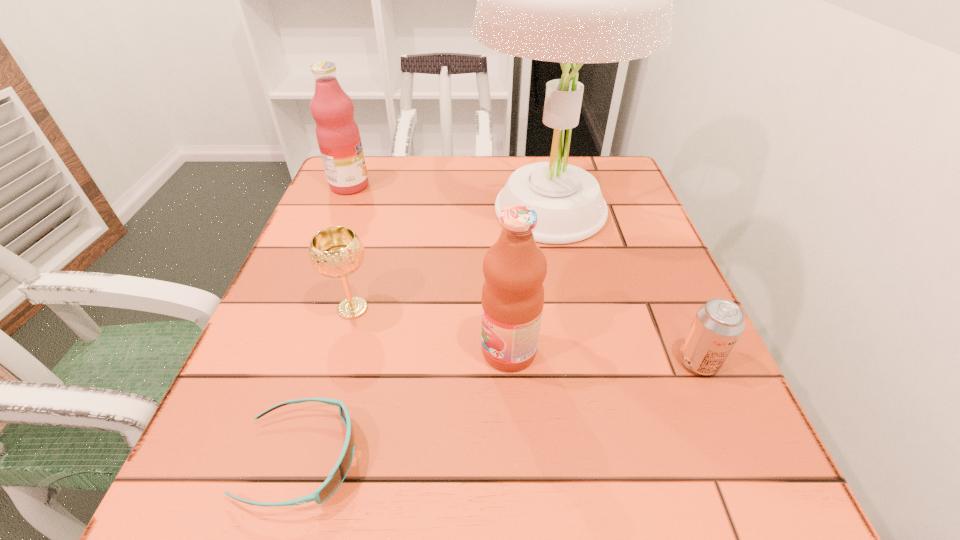
Identify which object is the second closest to the shortest object. Please provide its 2D coordinates. Your answer should be formatted as a tuple, i.e. [(x, y)], where the tuple contains the x and y coordinates of a point satisfying the conditions above.

[(514, 267)]

Locate which object ranks in proximity to the third farthest object. Please provide its 2D coordinates. Your answer should be formatted as a tuple, i.e. [(x, y)], where the tuple contains the x and y coordinates of a point satisfying the conditions above.

[(337, 475)]